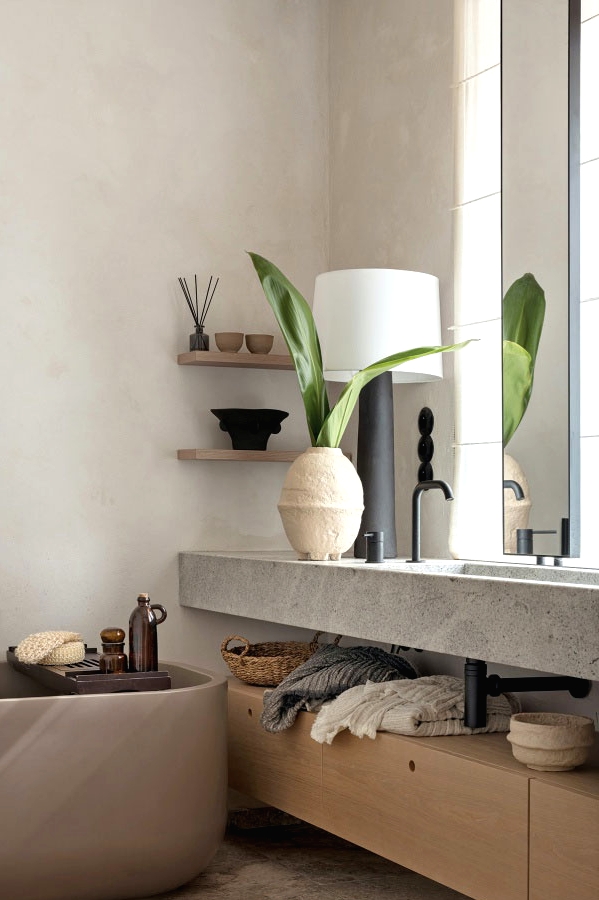
Where is `black bowl`? This screenshot has height=900, width=599. black bowl is located at coordinates (249, 428).